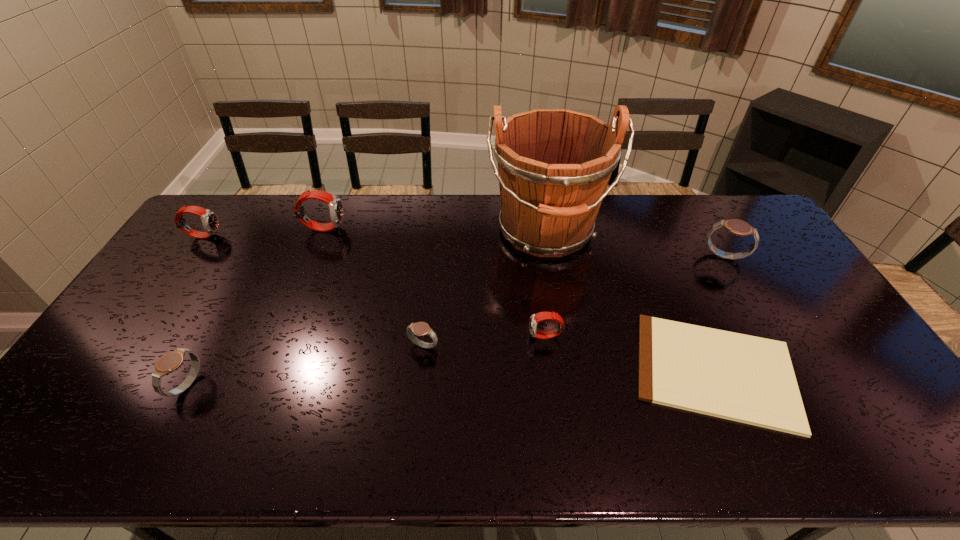
What are the coordinates of `gray watch object that ranks as the second closest to the clipboard` in the screenshot? It's located at (420, 328).

This screenshot has height=540, width=960. Identify the location of free space that satisfies the following two spatial constraints: 1. on the face of the third farthest watch; 2. on the right side of the second red watch from right to left. (312, 257).

The width and height of the screenshot is (960, 540). I want to click on vacant space that satisfies the following two spatial constraints: 1. on the face of the leftmost watch; 2. on the left side of the biggest gray watch, so click(x=189, y=257).

You are a GUI agent. You are given a task and a screenshot of the screen. Output one action in this format:
    pyautogui.click(x=<x>, y=<y>)
    Task: Click on the free spot that satisfies the following two spatial constraints: 1. with the handle on the side of the tallest object; 2. on the left side of the clipboard
    
    Given the screenshot: What is the action you would take?
    pyautogui.click(x=569, y=371)

The image size is (960, 540). Find the location of `vacant region that satisfies the following two spatial constraints: 1. with the handle on the side of the bucket; 2. on the face of the leftmost watch`. vacant region that satisfies the following two spatial constraints: 1. with the handle on the side of the bucket; 2. on the face of the leftmost watch is located at coordinates (546, 235).

The height and width of the screenshot is (540, 960). I want to click on free point that satisfies the following two spatial constraints: 1. on the face of the leftmost watch; 2. on the left side of the rightmost watch, so click(x=189, y=257).

Where is `free space that satisfies the following two spatial constraints: 1. on the face of the third watch from left to right; 2. on the right side of the rightmost watch`? Image resolution: width=960 pixels, height=540 pixels. free space that satisfies the following two spatial constraints: 1. on the face of the third watch from left to right; 2. on the right side of the rightmost watch is located at coordinates (312, 257).